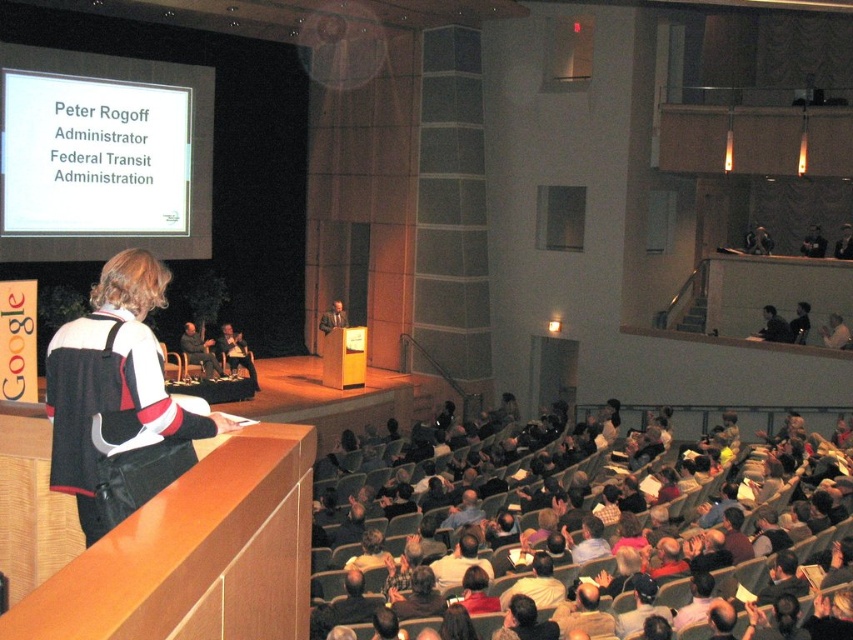
From the picture: Is dark gray suit at center positioned before matte black podium at center?

Yes, it is.

Who is more distant from viewer, [206,342] or [328,326]?

Positioned behind is point [328,326].

Locate an element on the screen. The height and width of the screenshot is (640, 853). dark gray suit at center is located at coordinates (199, 349).

Which is more to the right, dark gray fabric chair at center or matte black podium at center?

matte black podium at center is more to the right.

Between point (231, 365) and point (322, 330), which one is positioned in front?

Point (231, 365)

The image size is (853, 640). Identify the location of dark gray fabric chair at center. (235, 353).

Between dark gray fabric chair at center and dark gray suit at center, which one is positioned lower?

dark gray fabric chair at center is below.

Describe the element at coordinates (235, 353) in the screenshot. I see `dark gray fabric chair at center` at that location.

The width and height of the screenshot is (853, 640). What do you see at coordinates (235, 353) in the screenshot?
I see `dark gray fabric chair at center` at bounding box center [235, 353].

Locate an element on the screen. dark gray fabric chair at center is located at coordinates (235, 353).